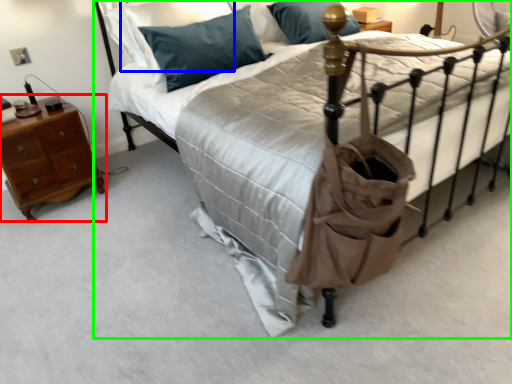
Question: Which object is the farthest from nightstand (highlighted by a red box)? Choose among these: pillow (highlighted by a blue box) or bed (highlighted by a green box).

Choices:
 (A) pillow
 (B) bed

Answer: (B)